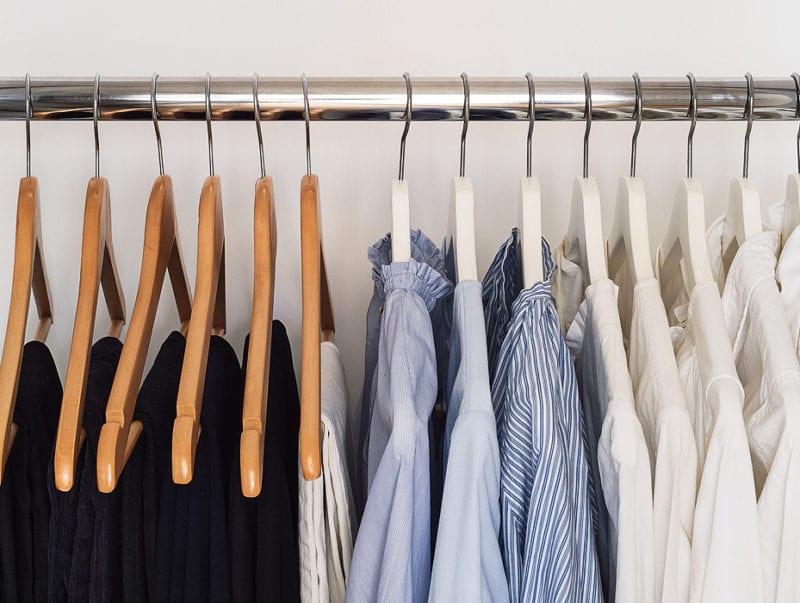
What are the coordinates of `brown wooden clothes hanger` in the screenshot? It's located at (26, 221), (93, 219), (148, 216), (204, 216), (261, 216), (306, 221).